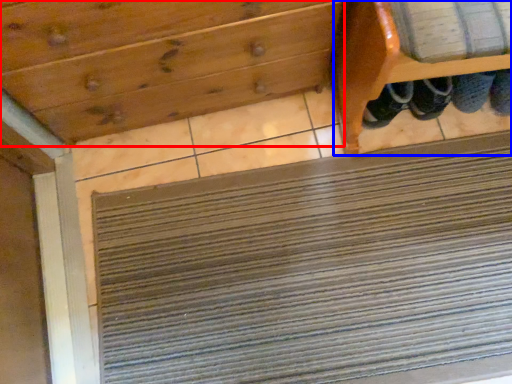
Question: Among these objects, which one is farthest to the camera, drawer (highlighted by a red box) or furniture (highlighted by a blue box)?

Choices:
 (A) drawer
 (B) furniture

Answer: (A)